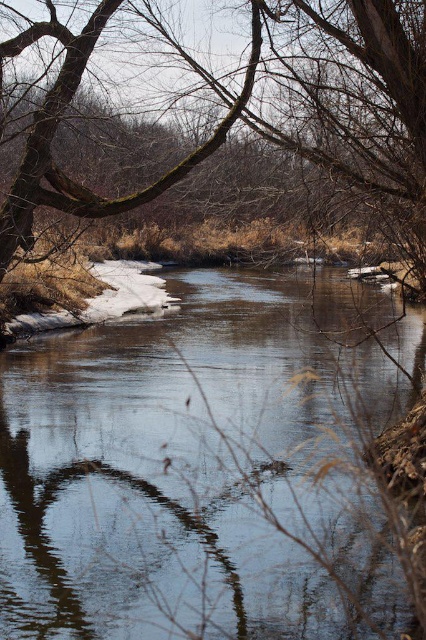
Is clear water at center closer to camera compared to brown mossy branch at upper left?

Yes, it is in front of brown mossy branch at upper left.

Does clear water at center have a smaller size compared to brown mossy branch at upper left?

Incorrect, clear water at center is not smaller in size than brown mossy branch at upper left.

Find the location of `clear water at center`. clear water at center is located at coordinates (175, 464).

At what (x,y) coordinates should I click in order to perform the action: click on clear water at center. Please return your answer as a coordinate pair (x, y). The height and width of the screenshot is (640, 426). Looking at the image, I should click on (175, 464).